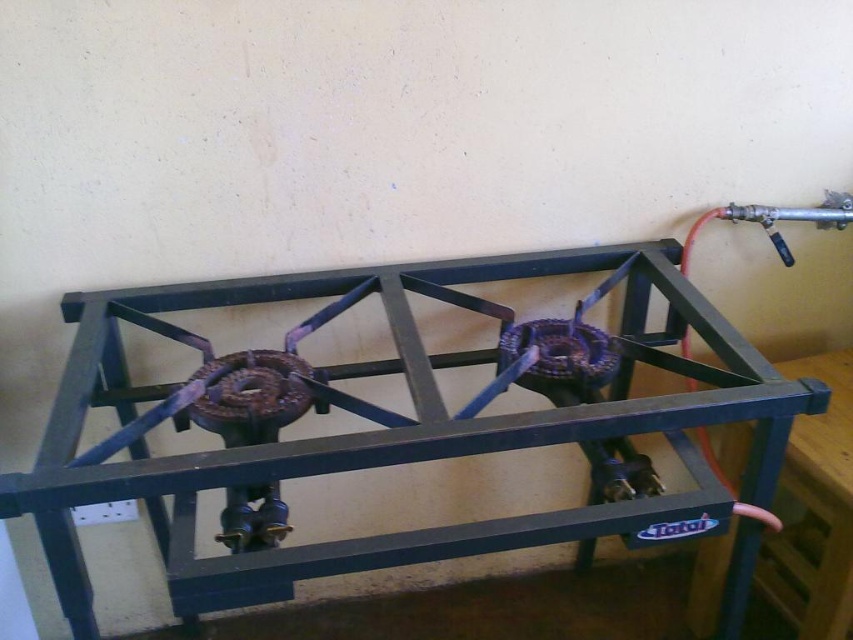
From the picture: Which is above, black metal gas stove at center or metallic blue table at right?

Positioned higher is black metal gas stove at center.

Who is more distant from viewer, (660, 518) or (837, 433)?

The point (837, 433) is behind.

Identify the location of black metal gas stove at center. (392, 428).